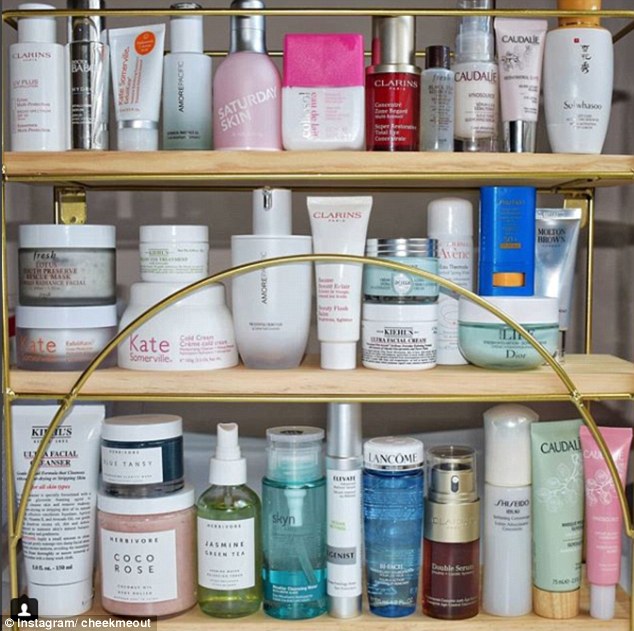
Where is `top wooden shelf`? Image resolution: width=634 pixels, height=631 pixels. top wooden shelf is located at coordinates (145, 154), (269, 155), (489, 154).